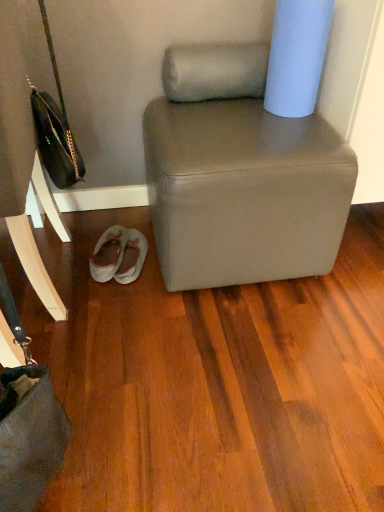
Question: Is matte gray ottoman at center oriented towards matte black handbag at left?

Choices:
 (A) yes
 (B) no

Answer: (B)

Question: Can you see matte gray ottoman at center touching matte black handbag at left?

Choices:
 (A) no
 (B) yes

Answer: (A)

Question: Can you confirm if matte gray ottoman at center is smaller than matte black handbag at left?

Choices:
 (A) yes
 (B) no

Answer: (B)

Question: Is matte gray ottoman at center to the left of matte black handbag at left from the viewer's perspective?

Choices:
 (A) no
 (B) yes

Answer: (A)

Question: Is matte gray ottoman at center taller than matte black handbag at left?

Choices:
 (A) no
 (B) yes

Answer: (A)

Question: From the image's perspective, is matte gray ottoman at center on matte black handbag at left?

Choices:
 (A) yes
 (B) no

Answer: (B)

Question: From the image's perspective, would you say light gray suede slippers at lower left is positioned over leather handbag at left?

Choices:
 (A) no
 (B) yes

Answer: (A)

Question: From a real-world perspective, is light gray suede slippers at lower left positioned under leather handbag at left based on gravity?

Choices:
 (A) no
 (B) yes

Answer: (B)

Question: Would you consider light gray suede slippers at lower left to be distant from leather handbag at left?

Choices:
 (A) no
 (B) yes

Answer: (A)

Question: Does light gray suede slippers at lower left have a smaller size compared to leather handbag at left?

Choices:
 (A) no
 (B) yes

Answer: (B)

Question: Is light gray suede slippers at lower left completely or partially outside of leather handbag at left?

Choices:
 (A) no
 (B) yes

Answer: (B)

Question: Does light gray suede slippers at lower left come in front of leather handbag at left?

Choices:
 (A) yes
 (B) no

Answer: (B)

Question: From the image's perspective, would you say matte black handbag at left is shown under leather handbag at left?

Choices:
 (A) yes
 (B) no

Answer: (B)